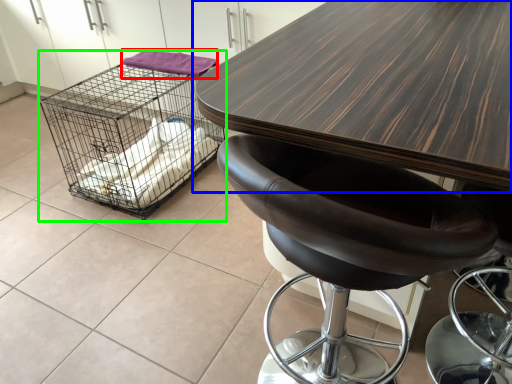
Question: Which is nearer to the material (highlighted by a red box)? table (highlighted by a blue box) or bird cage (highlighted by a green box).

Choices:
 (A) table
 (B) bird cage

Answer: (B)